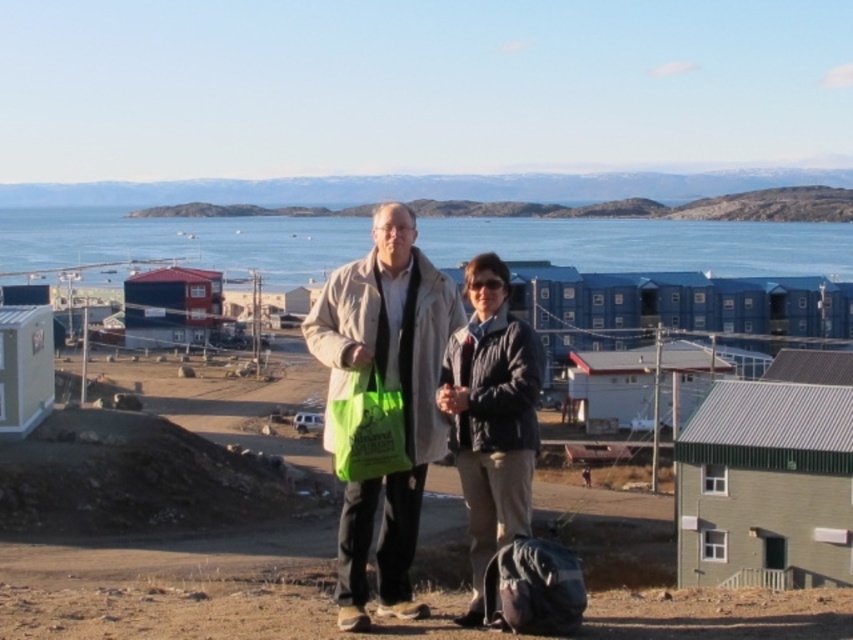
Question: Which point is farther to the camera?

Choices:
 (A) coord(527,538)
 (B) coord(503,451)

Answer: (B)

Question: Among these objects, which one is nearest to the camera?

Choices:
 (A) beige fabric coat at center
 (B) green plastic bag at center
 (C) blue water at center
 (D) dark blue quilted jacket at center

Answer: (A)

Question: Does beige fabric coat at center have a greater width compared to green plastic bag at center?

Choices:
 (A) yes
 (B) no

Answer: (A)

Question: Does blue water at center have a smaller size compared to green plastic bag at center?

Choices:
 (A) yes
 (B) no

Answer: (B)

Question: Which point is farther from the camera taking this photo?

Choices:
 (A) (364, 396)
 (B) (537, 589)
 (C) (479, 451)

Answer: (C)

Question: Is beige fabric coat at center in front of green plastic bag at center?

Choices:
 (A) no
 (B) yes

Answer: (B)